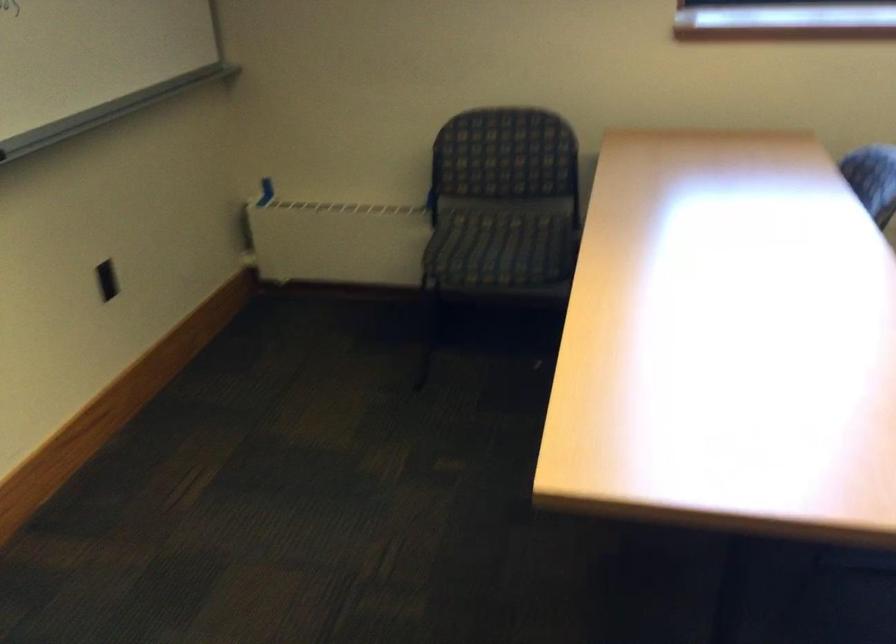
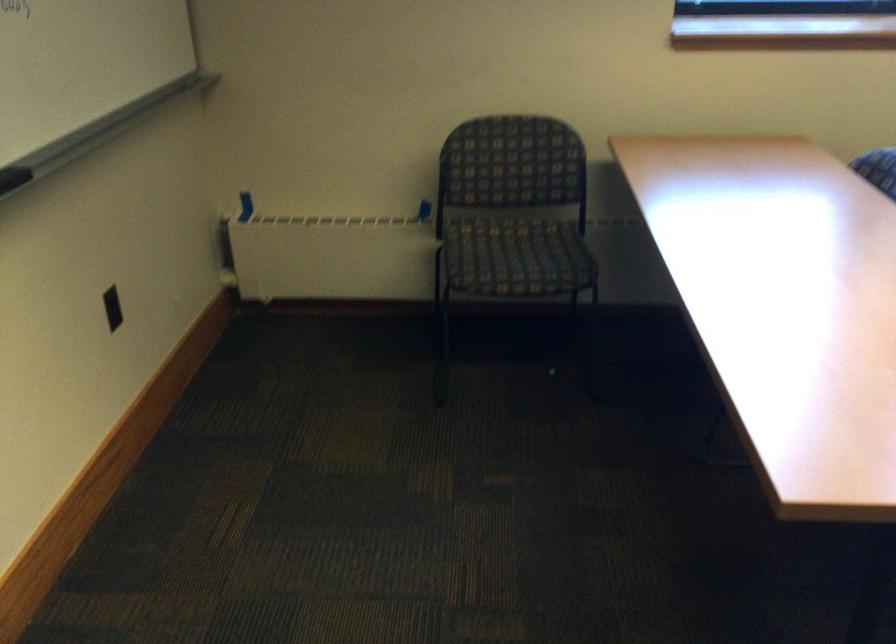
In the second image, find the point that corresponds to point (487, 210) in the first image.

(488, 220)